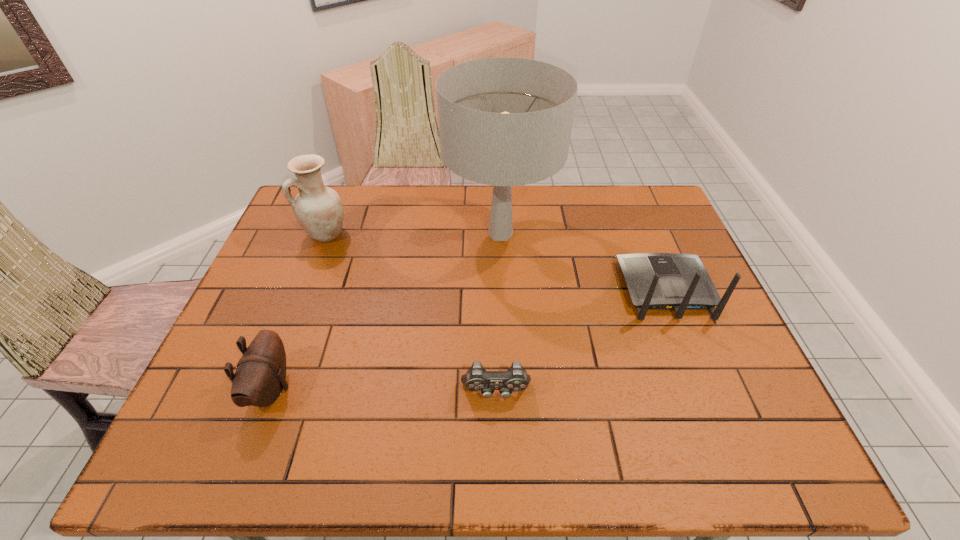
At what (x,y) coordinates should I click in order to perform the action: click on empty space that is in between the shortest object and the rightmost object. Please return your answer as a coordinate pair (x, y). Looking at the image, I should click on (581, 341).

This screenshot has height=540, width=960. What are the coordinates of `free space between the tallest object and the pouch` in the screenshot? It's located at (386, 312).

The image size is (960, 540). I want to click on vacant region between the rightmost object and the pouch, so click(x=468, y=339).

This screenshot has width=960, height=540. What are the coordinates of `empty location between the control and the pouch` in the screenshot? It's located at (384, 390).

Identify the location of vacant space in between the fourth shortest object and the rightmost object. (495, 262).

Locate which object ranks third in proximity to the shortest object. Please provide its 2D coordinates. Your answer should be formatted as a tuple, i.e. [(x, y)], where the tuple contains the x and y coordinates of a point satisfying the conditions above.

[(260, 377)]

Locate which object is the closest to the shortest object. Please provide its 2D coordinates. Your answer should be formatted as a tuple, i.e. [(x, y)], where the tuple contains the x and y coordinates of a point satisfying the conditions above.

[(656, 281)]

At what (x,y) coordinates should I click in order to perform the action: click on vacant point that satisfies the following two spatial constraints: 1. on the front-facing side of the lampshade; 2. on the front side of the pottery. Please return your answer as a coordinate pair (x, y). The height and width of the screenshot is (540, 960). Looking at the image, I should click on (500, 234).

Locate an element on the screen. Image resolution: width=960 pixels, height=540 pixels. vacant space that satisfies the following two spatial constraints: 1. on the front-facing side of the tallest object; 2. on the surface of the shortest object with buttons is located at coordinates (509, 392).

Identify the location of free space that satisfies the following two spatial constraints: 1. on the front-facing side of the lampshade; 2. on the surface of the shortest object with buttons. (509, 392).